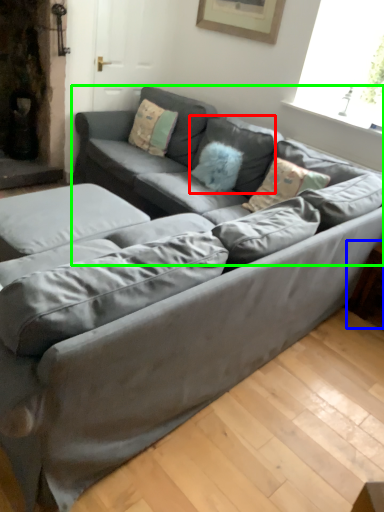
Question: Which object is positioned closest to pillow (highlighted by a red box)? Select from side table (highlighted by a blue box) and couch (highlighted by a green box).

Choices:
 (A) side table
 (B) couch

Answer: (B)